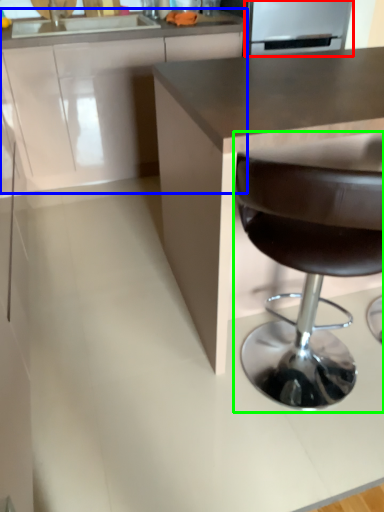
Question: Estimate the real-world distances between objects in this image. Which object is farther from appliance (highlighted by a red box), cabinetry (highlighted by a blue box) or chair (highlighted by a green box)?

Choices:
 (A) cabinetry
 (B) chair

Answer: (B)